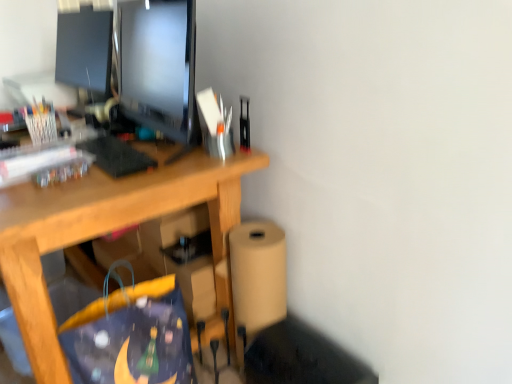
In order to face blue fabric shopping bag at lower center, should I rotate leftwards or rightwards?

A 15.633 degree turn to the left will do.

Describe the element at coordinates (131, 335) in the screenshot. This screenshot has width=512, height=384. I see `blue fabric shopping bag at lower center` at that location.

Locate an element on the screen. The width and height of the screenshot is (512, 384). translucent plastic pen holder at upper left, which is the 2th stationery from front to back is located at coordinates (41, 122).

From a real-world perspective, is blue fabric shopping bag at lower center physically above metallic silver stapler at upper right, positioned as the first stationery in front-to-back order?

No, from a real-world perspective, blue fabric shopping bag at lower center is not over metallic silver stapler at upper right, positioned as the first stationery in front-to-back order

Based on the photo, which object is positioned more to the left, blue fabric shopping bag at lower center or metallic silver stapler at upper right, the first stationery positioned from the right?

blue fabric shopping bag at lower center is more to the left.

Is point (100, 382) less distant than point (247, 149)?

Yes, point (100, 382) is in front of point (247, 149).

From the image's perspective, between blue fabric shopping bag at lower center and metallic silver stapler at upper right, the first stationery positioned from the right, which one is located above?

metallic silver stapler at upper right, the first stationery positioned from the right, is shown above in the image.

Identify the location of television above the metallic silver stapler at upper right, which is the second stationery from left to right (from the image's perspective). The height and width of the screenshot is (384, 512). (158, 65).

Can you see metallic silver stapler at upper right, positioned as the first stationery in front-to-back order, touching matte black monitor at upper left?

No.

Considering the positions of objects metallic silver stapler at upper right, positioned as the first stationery in front-to-back order, and matte black monitor at upper left in the image provided, who is in front, metallic silver stapler at upper right, positioned as the first stationery in front-to-back order, or matte black monitor at upper left?

matte black monitor at upper left is more forward.

Locate an element on the screen. This screenshot has width=512, height=384. stationery on the left of matte black monitor at upper left is located at coordinates (41, 122).

Is translucent plastic pen holder at upper left, which appears as the second stationery when viewed from the right, inside or outside of matte black monitor at upper left?

translucent plastic pen holder at upper left, which appears as the second stationery when viewed from the right, cannot be found inside matte black monitor at upper left.

Is translucent plastic pen holder at upper left, which appears as the second stationery when viewed from the right, wider than matte black monitor at upper left?

Incorrect, the width of translucent plastic pen holder at upper left, which appears as the second stationery when viewed from the right, does not surpass that of matte black monitor at upper left.

Based on the photo, from a real-world perspective, which object rests below the other?

From a 3D spatial view, translucent plastic pen holder at upper left, which is the 2th stationery from front to back, is below.

From the picture: From the image's perspective, which object appears higher, translucent plastic pen holder at upper left, the 1th stationery positioned from the back, or metallic silver stapler at upper right, positioned as the second stationery in back-to-front order?

translucent plastic pen holder at upper left, the 1th stationery positioned from the back.

Can you tell me how much translucent plastic pen holder at upper left, which appears as the second stationery when viewed from the right, and metallic silver stapler at upper right, positioned as the second stationery in back-to-front order, differ in facing direction?

translucent plastic pen holder at upper left, which appears as the second stationery when viewed from the right, and metallic silver stapler at upper right, positioned as the second stationery in back-to-front order, are facing 5.66 degrees away from each other.

Consider the image. From the image's perspective, between matte black monitor at upper left and metallic silver stapler at upper right, positioned as the first stationery in front-to-back order, which one is located above?

matte black monitor at upper left, from the image's perspective.

Is matte black monitor at upper left completely or partially outside of metallic silver stapler at upper right, positioned as the first stationery in front-to-back order?

Yes, matte black monitor at upper left is located beyond the bounds of metallic silver stapler at upper right, positioned as the first stationery in front-to-back order.

Does point (153, 42) come in front of point (245, 122)?

That is True.

Is translucent plastic pen holder at upper left, the first stationery positioned from the left, positioned far away from blue fabric shopping bag at lower center?

No, there isn't a large distance between translucent plastic pen holder at upper left, the first stationery positioned from the left, and blue fabric shopping bag at lower center.

Which is nearer, (x=48, y=102) or (x=142, y=352)?

Point (x=48, y=102) is farther from the camera than point (x=142, y=352).

From a real-world perspective, which is physically above, translucent plastic pen holder at upper left, the first stationery positioned from the left, or blue fabric shopping bag at lower center?

translucent plastic pen holder at upper left, the first stationery positioned from the left.

Considering the positions of objects translucent plastic pen holder at upper left, which appears as the second stationery when viewed from the right, and blue fabric shopping bag at lower center in the image provided, who is behind, translucent plastic pen holder at upper left, which appears as the second stationery when viewed from the right, or blue fabric shopping bag at lower center?

translucent plastic pen holder at upper left, which appears as the second stationery when viewed from the right, is behind.

Is matte black monitor at upper left looking in the opposite direction of translucent plastic pen holder at upper left, the 1th stationery positioned from the back?

matte black monitor at upper left is not turned away from translucent plastic pen holder at upper left, the 1th stationery positioned from the back.

From the image's perspective, is matte black monitor at upper left located above or below translucent plastic pen holder at upper left, the 1th stationery positioned from the back?

From the image's perspective, matte black monitor at upper left appears above translucent plastic pen holder at upper left, the 1th stationery positioned from the back.

Is matte black monitor at upper left with translucent plastic pen holder at upper left, the first stationery positioned from the left?

No, matte black monitor at upper left is not with translucent plastic pen holder at upper left, the first stationery positioned from the left.

I want to click on shopping bag in front of the metallic silver stapler at upper right, which is the second stationery from left to right, so click(131, 335).

Locate an element on the screen. The width and height of the screenshot is (512, 384). the 2nd stationery below the matte black monitor at upper left (from the image's perspective) is located at coordinates (244, 124).

From the image, which object appears to be nearer to translucent plastic pen holder at upper left, the first stationery positioned from the left, blue fabric shopping bag at lower center or matte black monitor at upper left?

matte black monitor at upper left is positioned closer to the anchor translucent plastic pen holder at upper left, the first stationery positioned from the left.

Looking at the image, which one is located further to matte black monitor at upper left, translucent plastic pen holder at upper left, which is the 2th stationery from front to back, or metallic silver stapler at upper right, the first stationery positioned from the right?

translucent plastic pen holder at upper left, which is the 2th stationery from front to back, is further to matte black monitor at upper left.

Estimate the real-world distances between objects in this image. Which object is further from blue fabric shopping bag at lower center, translucent plastic pen holder at upper left, which appears as the second stationery when viewed from the right, or matte black monitor at upper left?

translucent plastic pen holder at upper left, which appears as the second stationery when viewed from the right.

Considering their positions, is translucent plastic pen holder at upper left, which is the 2th stationery from front to back, positioned closer to metallic silver stapler at upper right, positioned as the second stationery in back-to-front order, than blue fabric shopping bag at lower center?

blue fabric shopping bag at lower center.

Which object lies further to the anchor point translucent plastic pen holder at upper left, which is the 2th stationery from front to back, metallic silver stapler at upper right, positioned as the second stationery in back-to-front order, or matte black monitor at upper left?

metallic silver stapler at upper right, positioned as the second stationery in back-to-front order, is further to translucent plastic pen holder at upper left, which is the 2th stationery from front to back.

Which object lies further to the anchor point metallic silver stapler at upper right, which is the second stationery from left to right, matte black monitor at upper left or blue fabric shopping bag at lower center?

The object further to metallic silver stapler at upper right, which is the second stationery from left to right, is blue fabric shopping bag at lower center.

When comparing their distances from blue fabric shopping bag at lower center, does translucent plastic pen holder at upper left, which is the 2th stationery from front to back, or metallic silver stapler at upper right, positioned as the second stationery in back-to-front order, seem closer?

Among the two, metallic silver stapler at upper right, positioned as the second stationery in back-to-front order, is located nearer to blue fabric shopping bag at lower center.

From the image, which object appears to be nearer to blue fabric shopping bag at lower center, metallic silver stapler at upper right, positioned as the second stationery in back-to-front order, or matte black monitor at upper left?

Based on the image, matte black monitor at upper left appears to be nearer to blue fabric shopping bag at lower center.

You are a GUI agent. You are given a task and a screenshot of the screen. Output one action in this format:
    pyautogui.click(x=<x>, y=<y>)
    Task: Click on the stationery between translucent plastic pen holder at upper left, which is the 2th stationery from front to back, and blue fabric shopping bag at lower center from top to bottom
    
    Given the screenshot: What is the action you would take?
    pyautogui.click(x=244, y=124)

Identify the location of television situated between translucent plastic pen holder at upper left, which is the 2th stationery from front to back, and metallic silver stapler at upper right, the first stationery positioned from the right, from left to right. (158, 65).